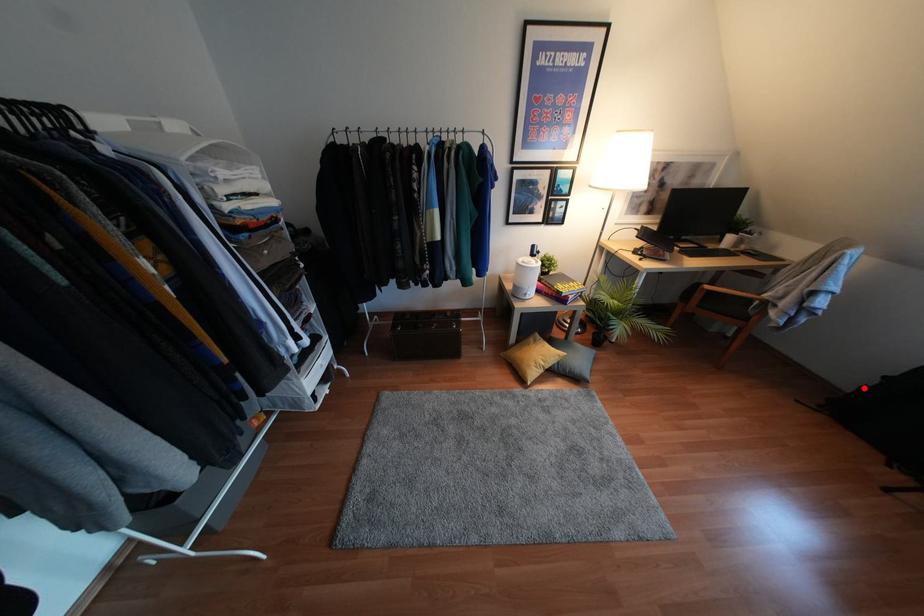
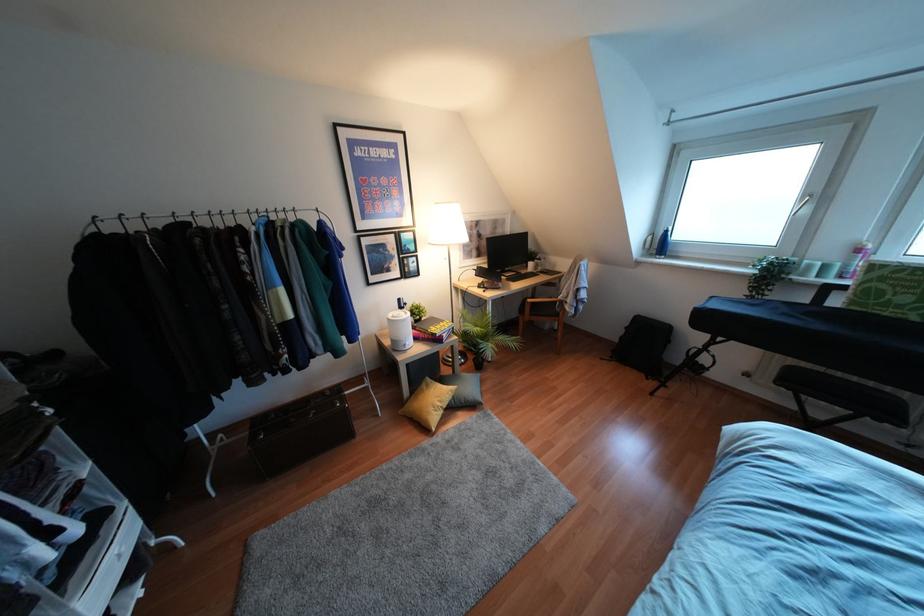
The point at the highlighted location is marked in the first image. Where is the corresponding point in the second image?

(621, 337)